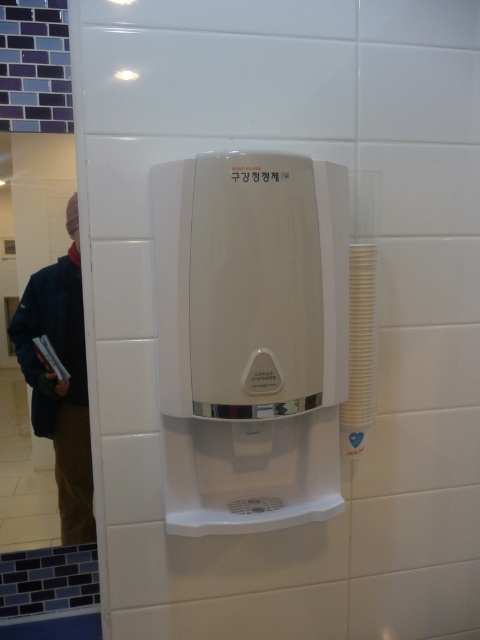
Question: Does white plastic water heater at center appear on the right side of dark blue denim jacket at left?

Choices:
 (A) yes
 (B) no

Answer: (A)

Question: Among these points, which one is nearest to the camera?

Choices:
 (A) coord(288,488)
 (B) coord(80,387)

Answer: (A)

Question: Is white plastic water heater at center to the right of dark blue denim jacket at left from the viewer's perspective?

Choices:
 (A) no
 (B) yes

Answer: (B)

Question: Which point is closer to the camera?

Choices:
 (A) dark blue denim jacket at left
 (B) white plastic water heater at center

Answer: (B)

Question: Can you confirm if white plastic water heater at center is positioned above dark blue denim jacket at left?

Choices:
 (A) yes
 (B) no

Answer: (A)